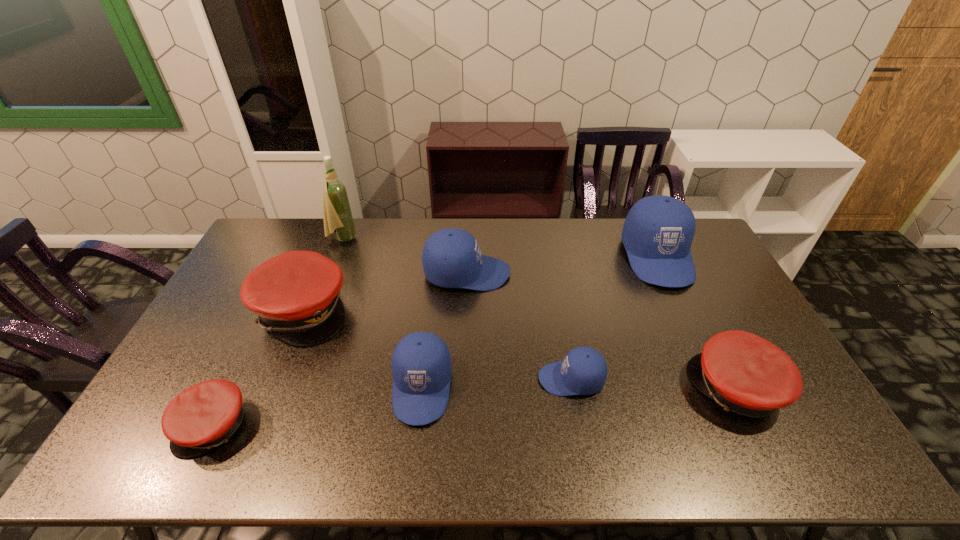
At what (x,y) coordinates should I click in order to perform the action: click on cap object that ranks as the fourth closest to the tallest cap. Please return your answer as a coordinate pair (x, y). The height and width of the screenshot is (540, 960). Looking at the image, I should click on (421, 364).

Identify the location of blue cap that is the third closest to the biggest red cap. The image size is (960, 540). (583, 371).

In order to click on the third closest blue cap relative to the smallest blue cap in this screenshot , I will do `click(658, 231)`.

Locate an element on the screen. Image resolution: width=960 pixels, height=540 pixels. red cap that stands as the second closest to the third biggest blue cap is located at coordinates (205, 415).

Where is `red cap that is the closest to the rightmost red cap`? This screenshot has width=960, height=540. red cap that is the closest to the rightmost red cap is located at coordinates (296, 294).

This screenshot has width=960, height=540. I want to click on free location that satisfies the following two spatial constraints: 1. on the front-facing side of the biggest blue cap; 2. at the front of the biggest red cap where the visor is located, so coord(683,311).

You are a GUI agent. You are given a task and a screenshot of the screen. Output one action in this format:
    pyautogui.click(x=<x>, y=<y>)
    Task: Click on the blank area in the image that satisfies the following two spatial constraints: 1. on the front-facing side of the sixth shortest cap; 2. at the front of the shortest object where the visor is located
    
    Given the screenshot: What is the action you would take?
    pyautogui.click(x=462, y=426)

Find the location of a particular element. The width and height of the screenshot is (960, 540). free point that satisfies the following two spatial constraints: 1. on the front-facing side of the third object from right to left; 2. on the front-facing side of the second smallest blue cap is located at coordinates (572, 387).

Identify the location of vacant space that satisfies the following two spatial constraints: 1. at the front of the rightmost red cap where the visor is located; 2. at the front of the shortest object where the visor is located. (755, 426).